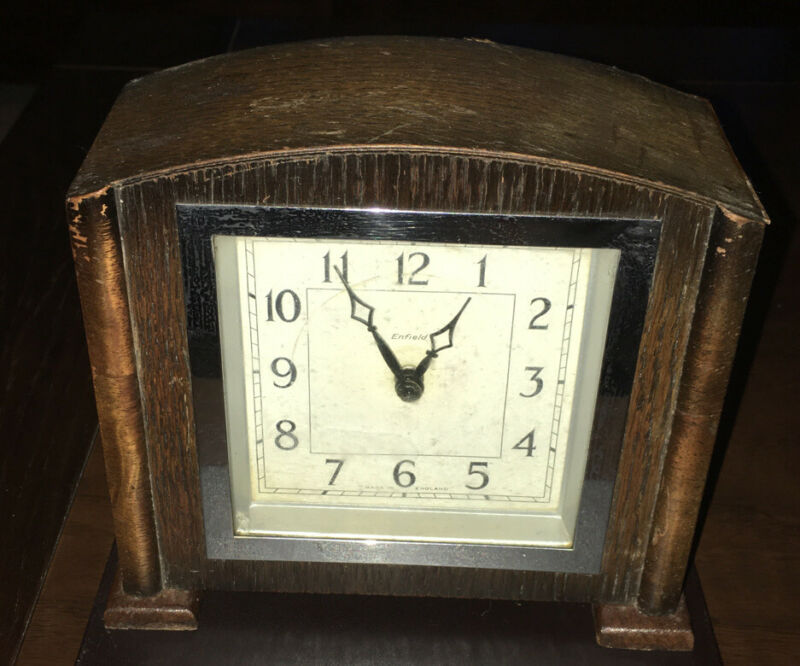
The width and height of the screenshot is (800, 666). In order to click on clock in this screenshot , I will do click(x=424, y=161).